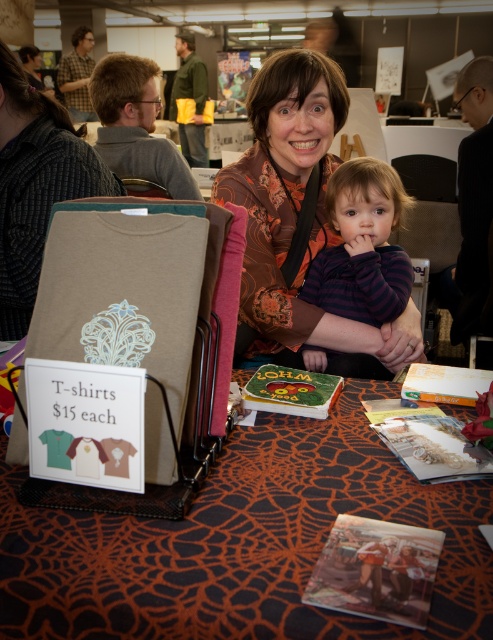
You are a customer at the event and want to see the orange spiderweb fabric at center and the matte orange blouse at center. Which item is closer to you?

The orange spiderweb fabric at center is closer to you because it is in front of the matte orange blouse at center.

You are a customer at this event and want to buy the beige T shirt with blue floral design. The cashier is at the point with coordinates (296, 216). Where should you go to pay for the T shirt?

The point at coordinates (296, 216) corresponds to the matte orange blouse at center, so you should go to the matte orange blouse at center to pay for the T shirt.